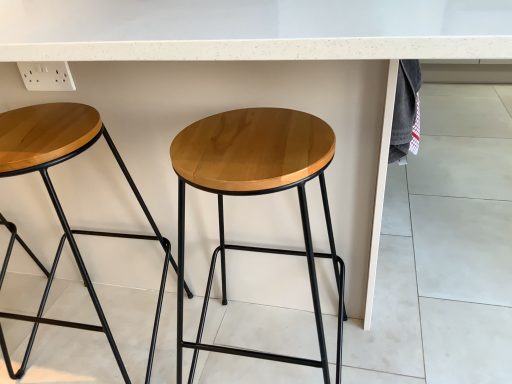
Question: From the image's perspective, is natural wood stool at center, which ranks as the 2th stool in left-to-right order, located above or below wooden seat stool at center, the first stool from the left?

Choices:
 (A) above
 (B) below

Answer: (B)

Question: From a real-world perspective, is natural wood stool at center, which ranks as the 2th stool in left-to-right order, positioned above or below wooden seat stool at center, marked as the second stool in a right-to-left arrangement?

Choices:
 (A) above
 (B) below

Answer: (A)

Question: Is point (231, 140) closer or farther from the camera than point (52, 160)?

Choices:
 (A) farther
 (B) closer

Answer: (B)

Question: Is wooden seat stool at center, the first stool from the left, taller or shorter than natural wood stool at center, which is the first stool from right to left?

Choices:
 (A) tall
 (B) short

Answer: (B)

Question: Would you say wooden seat stool at center, marked as the second stool in a right-to-left arrangement, is to the left or to the right of natural wood stool at center, which is the first stool from right to left, in the picture?

Choices:
 (A) right
 (B) left

Answer: (B)

Question: In the image, is wooden seat stool at center, marked as the second stool in a right-to-left arrangement, positioned in front of or behind natural wood stool at center, which ranks as the 2th stool in left-to-right order?

Choices:
 (A) behind
 (B) front

Answer: (A)

Question: Does point (70, 115) appear closer or farther from the camera than point (180, 187)?

Choices:
 (A) farther
 (B) closer

Answer: (B)